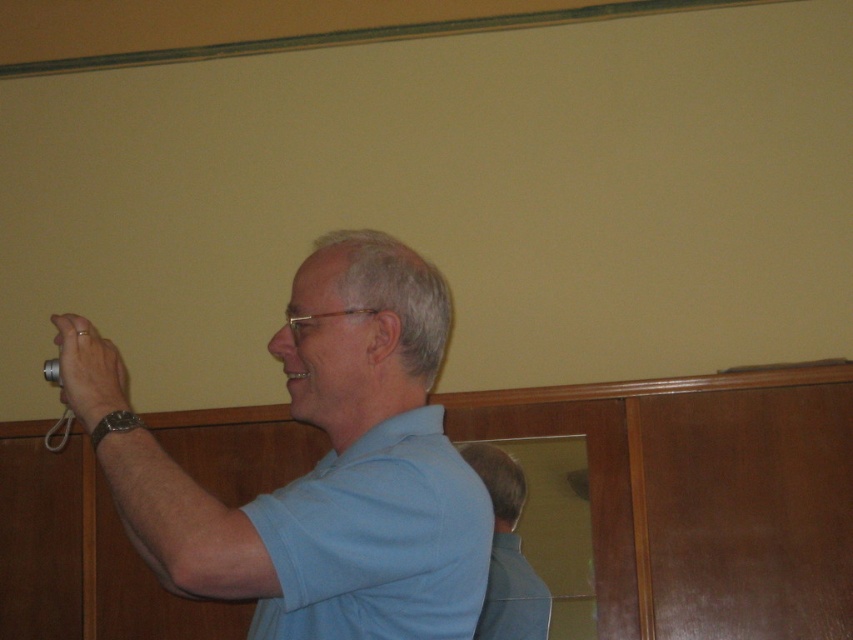
Question: Does blue matte shirt at center have a greater width compared to blue fabric shirt at center?

Choices:
 (A) yes
 (B) no

Answer: (A)

Question: Which of these objects is positioned farthest from the matte silver camera at left?

Choices:
 (A) blue matte shirt at center
 (B) blue fabric shirt at center

Answer: (B)

Question: Among these objects, which one is nearest to the camera?

Choices:
 (A) matte silver camera at left
 (B) blue matte shirt at center

Answer: (B)

Question: Among these points, which one is farthest from the camera?

Choices:
 (A) (299, 314)
 (B) (496, 573)

Answer: (B)

Question: Is blue matte shirt at center to the right of matte silver camera at left from the viewer's perspective?

Choices:
 (A) yes
 (B) no

Answer: (A)

Question: In this image, where is blue fabric shirt at center located relative to matte silver camera at left?

Choices:
 (A) below
 (B) above

Answer: (A)